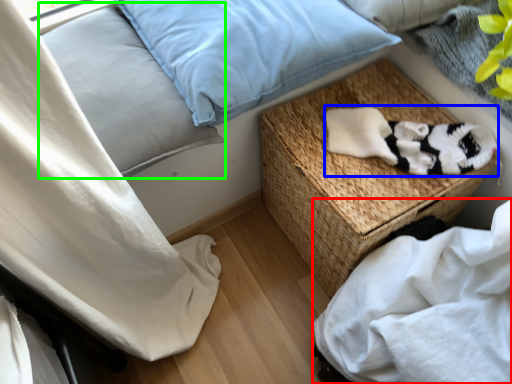
Question: Which is farther away from sheet (highlighted by a red box)? material (highlighted by a blue box) or pillow (highlighted by a green box)?

Choices:
 (A) material
 (B) pillow

Answer: (B)